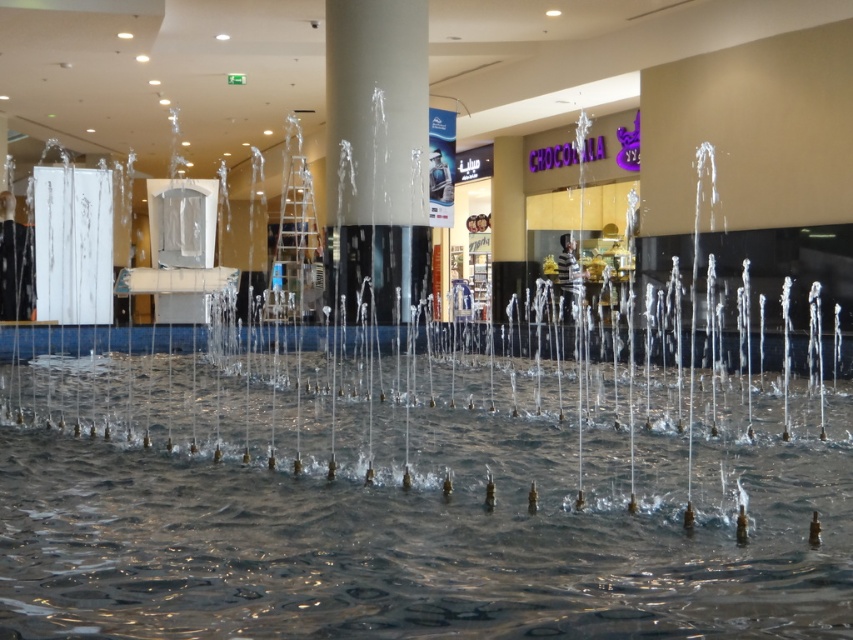
You are standing in the shopping mall and want to take a photo of the clear water at center and the white glossy pillar at center. Which object should you focus on first if you want both to be in sharp focus?

You should focus on the white glossy pillar at center first because it is farther away from the viewer than the clear water at center. By focusing on the farther object, you can ensure both are within the depth of field and in sharp focus.

You are a visitor at the mall and want to take a photo of the clear water at center and the white glossy pillar at center. Which object should you focus on first if you want to capture both in one shot without moving the camera?

You should focus on the white glossy pillar at center first because it is above the clear water at center, so adjusting focus to the pillar ensures both objects are in the frame without needing to move the camera.

You are standing in the shopping mall and want to locate the water fountain. According to the image, where exactly is the clear water at center located?

The clear water at center is located at point (410, 509).